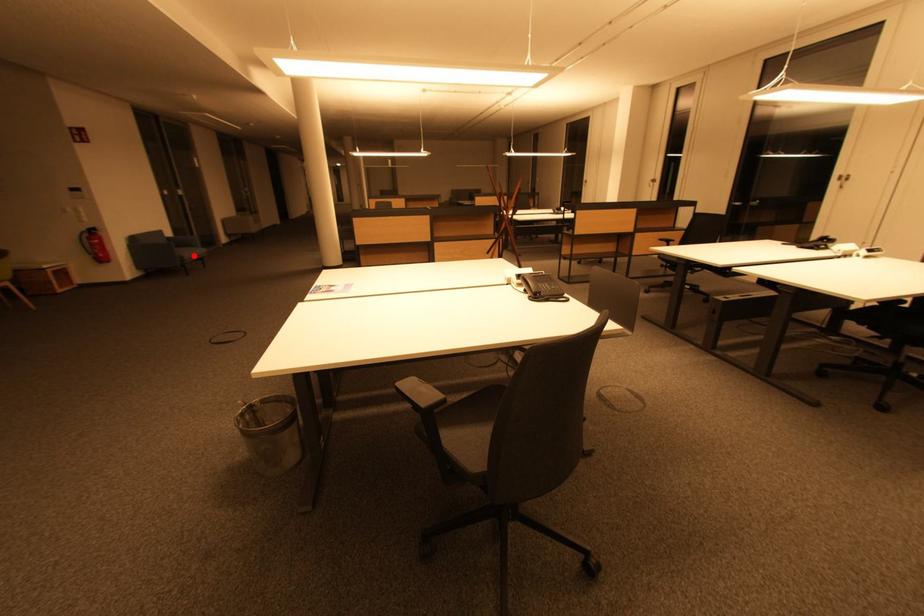
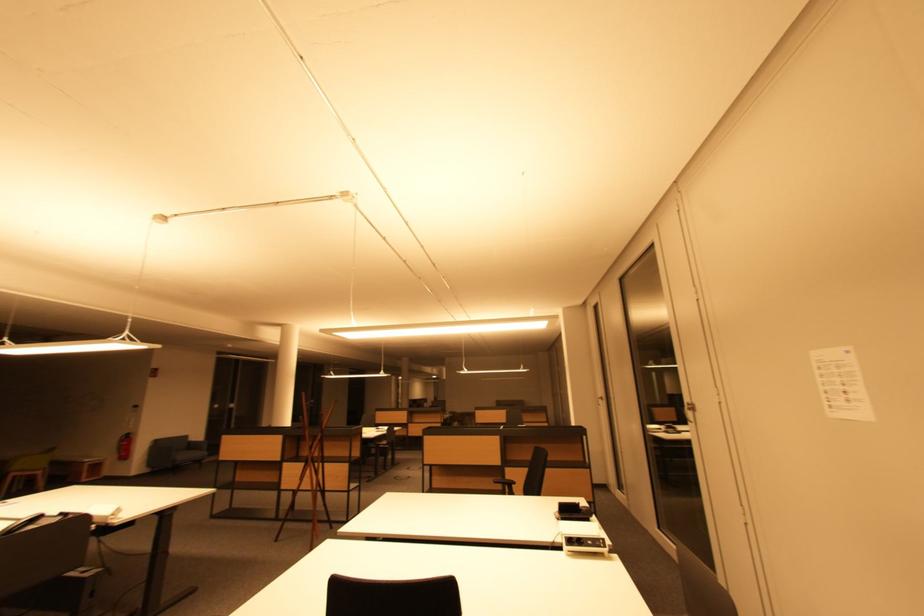
In the second image, find the point that corresponds to the highlighted location in the first image.

(188, 458)